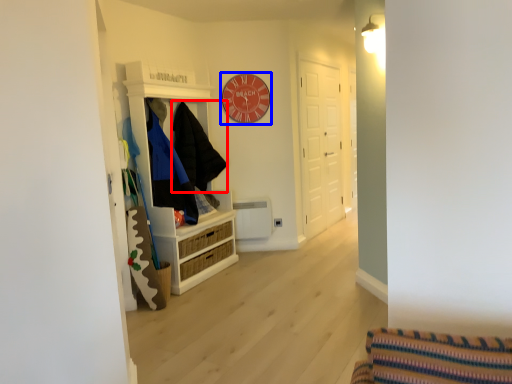
Question: Which object is further to the camera taking this photo, clothing (highlighted by a red box) or clock (highlighted by a blue box)?

Choices:
 (A) clothing
 (B) clock

Answer: (B)